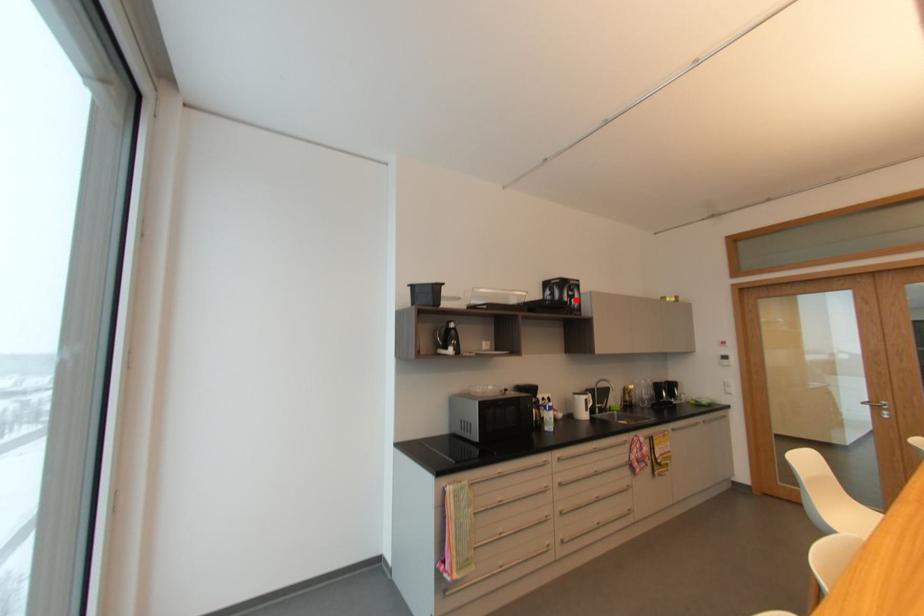
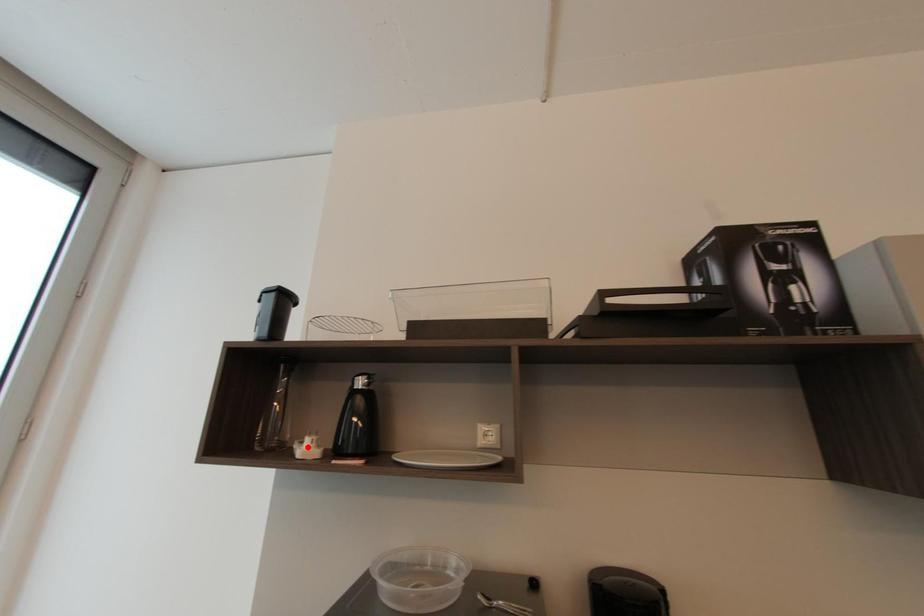
I am providing you with two images of the same scene from different viewpoints. A red point is marked on the first image and another point is marked on the second image. Are the points marked in image1 and image2 representing the same 3D position?

No